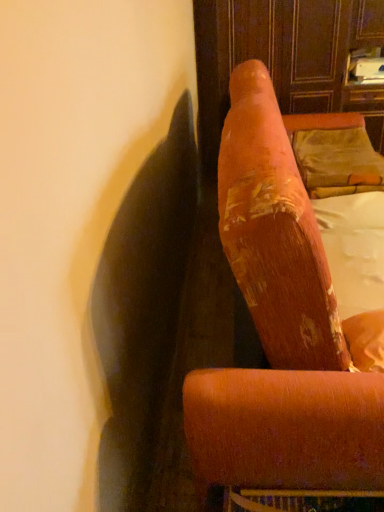
Question: Relative to white fabric at upper right, is velvet gold pillow at upper right in front or behind?

Choices:
 (A) behind
 (B) front

Answer: (A)

Question: From a real-world perspective, is velvet gold pillow at upper right above or below white fabric at upper right?

Choices:
 (A) below
 (B) above

Answer: (B)

Question: Estimate the real-world distances between objects in this image. Which object is closer to the velvet orange armchair at upper right?

Choices:
 (A) white fabric at upper right
 (B) velvet gold pillow at upper right

Answer: (A)

Question: Which is nearer to the velvet orange armchair at upper right?

Choices:
 (A) velvet gold pillow at upper right
 (B) white fabric at upper right

Answer: (B)